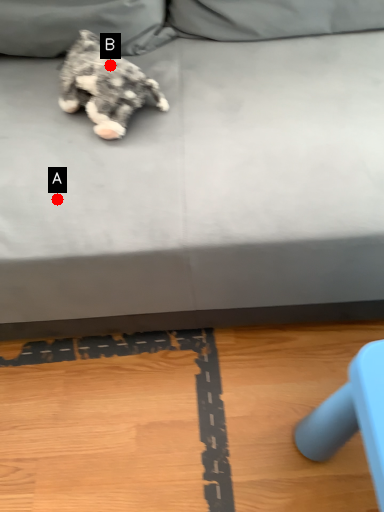
Question: Two points are circled on the image, labeled by A and B beside each circle. Which point is farther to the camera?

Choices:
 (A) A is further
 (B) B is further

Answer: (B)